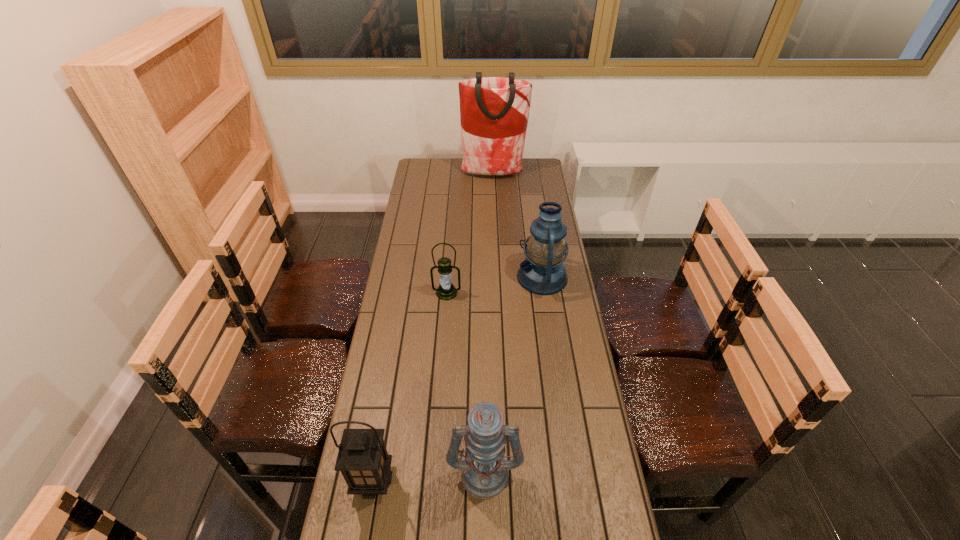
Locate an element on the screen. The height and width of the screenshot is (540, 960). empty location between the rightmost lantern and the shortest object is located at coordinates (494, 285).

I want to click on empty location between the rightmost lantern and the shortest object, so click(494, 285).

Locate an element on the screen. The height and width of the screenshot is (540, 960). free space between the leftmost object and the shortest object is located at coordinates (410, 386).

This screenshot has height=540, width=960. In order to click on free space between the rightmost lantern and the farthest object in this screenshot , I will do `click(517, 226)`.

Identify which object is located as the third nearest to the grocery bag. Please provide its 2D coordinates. Your answer should be formatted as a tuple, i.e. [(x, y)], where the tuple contains the x and y coordinates of a point satisfying the conditions above.

[(484, 473)]

Locate an element on the screen. The width and height of the screenshot is (960, 540). the fourth closest object to the rightmost lantern is located at coordinates (363, 460).

Select which lantern is the closest to the leftmost object. Please provide its 2D coordinates. Your answer should be formatted as a tuple, i.e. [(x, y)], where the tuple contains the x and y coordinates of a point satisfying the conditions above.

[(484, 473)]

In order to click on the second closest lantern to the grocery bag in this screenshot , I will do `click(446, 291)`.

You are a GUI agent. You are given a task and a screenshot of the screen. Output one action in this format:
    pyautogui.click(x=<x>, y=<y>)
    Task: Click on the blank area in the image that satisfies the following two spatial constraints: 1. on the back side of the leftmost object; 2. on the left side of the farthest object
    The height and width of the screenshot is (540, 960).
    Given the screenshot: What is the action you would take?
    pyautogui.click(x=424, y=174)

Identify the location of free spot that satisfies the following two spatial constraints: 1. on the face of the rightmost lantern; 2. on the side where the shortest lantern emits light. This screenshot has height=540, width=960. (544, 293).